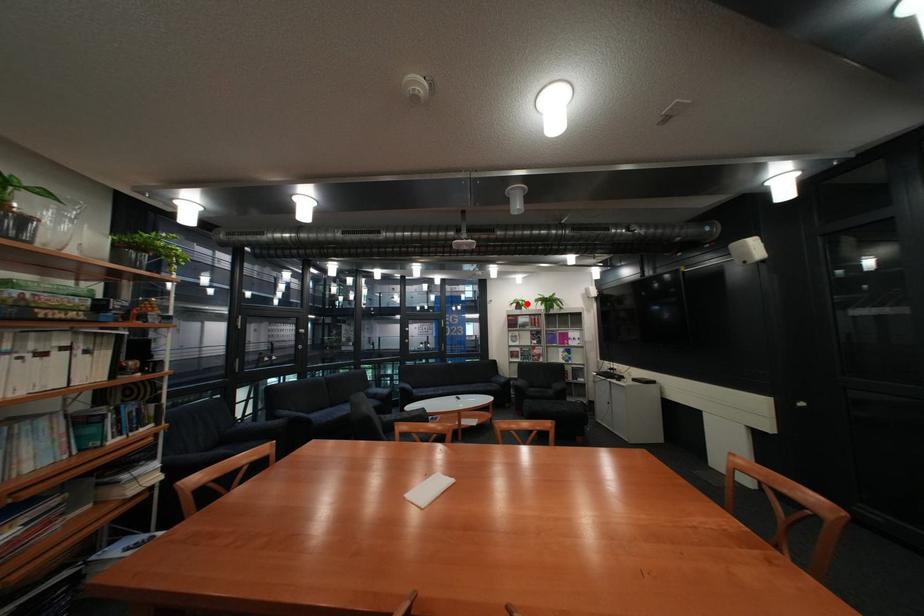
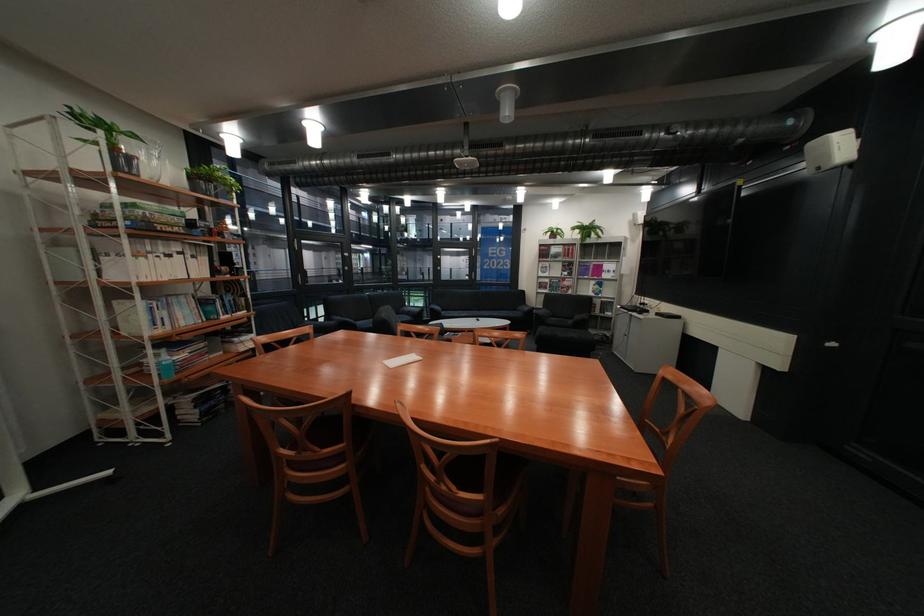
In the second image, find the point that corresponds to the highlighted location in the first image.

(562, 233)